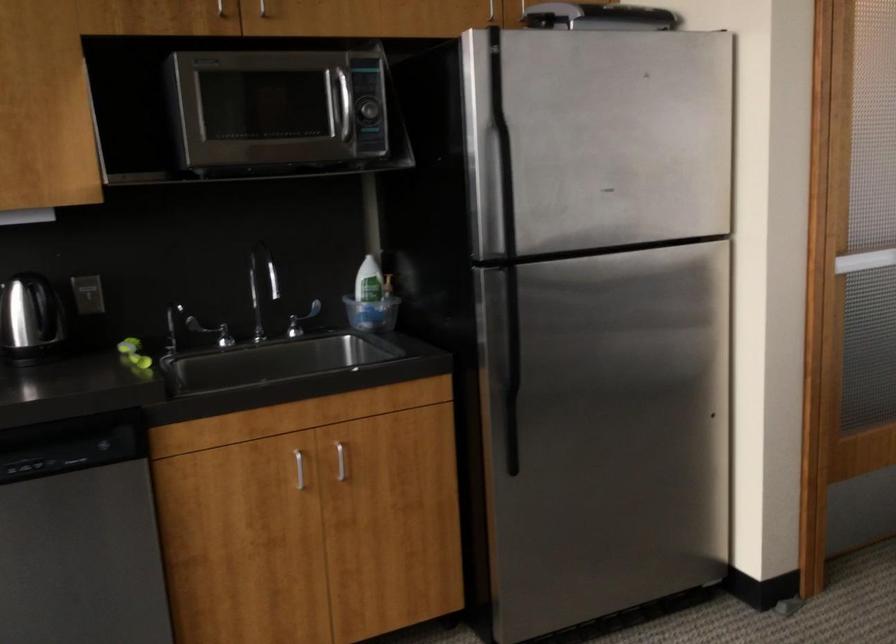
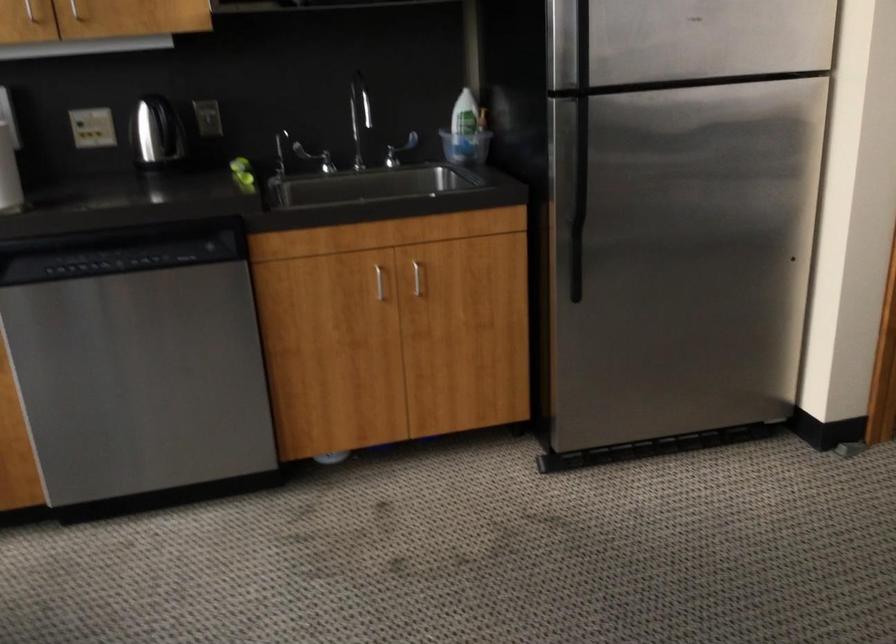
In a continuous first-person perspective shot, in which direction is the camera moving?

The cameraman walked toward right, backward.